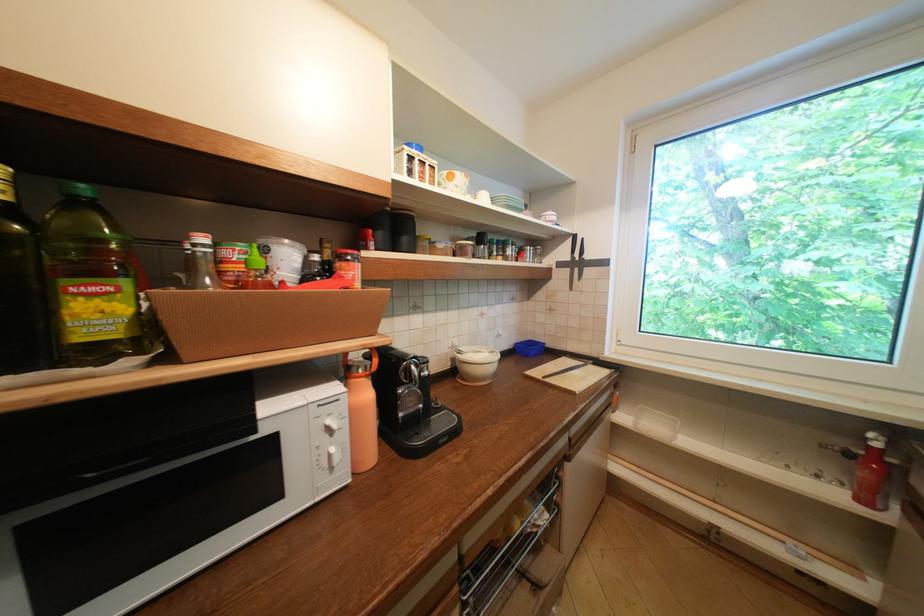
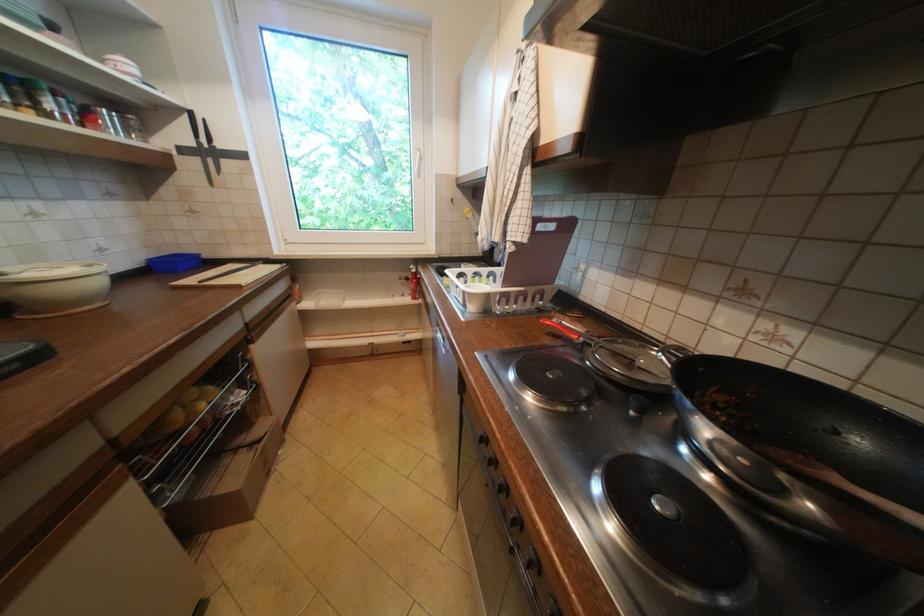
The point at [523,349] is marked in the first image. Where is the corresponding point in the second image?

(156, 267)